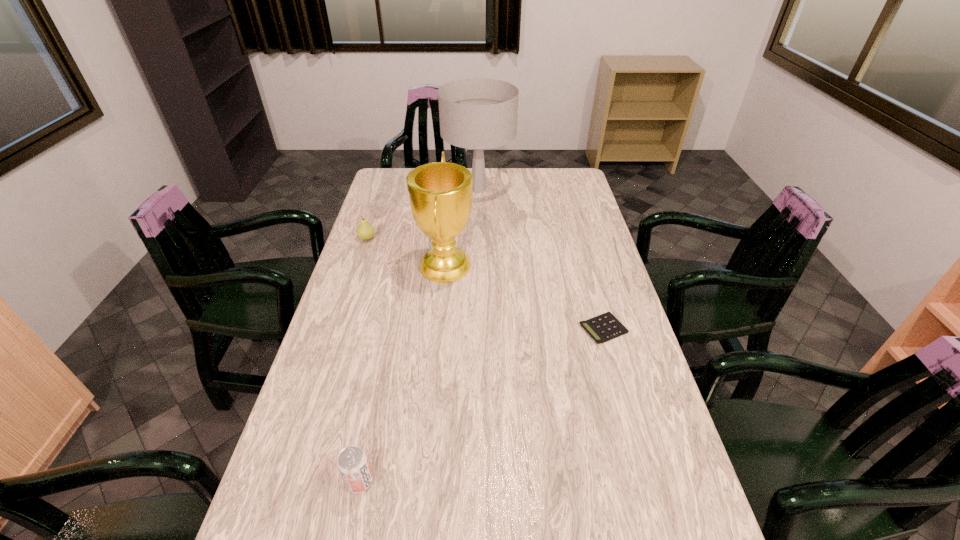
You are a GUI agent. You are given a task and a screenshot of the screen. Output one action in this format:
    pyautogui.click(x=<x>, y=<y>)
    Task: Click on the free space located on the back of the nearest object
    The image size is (960, 540).
    Given the screenshot: What is the action you would take?
    pyautogui.click(x=370, y=430)

Where is `free space located on the back of the leftmost object`? Image resolution: width=960 pixels, height=540 pixels. free space located on the back of the leftmost object is located at coordinates (372, 221).

You are a GUI agent. You are given a task and a screenshot of the screen. Output one action in this format:
    pyautogui.click(x=<x>, y=<y>)
    Task: Click on the vacant point located 0.190m on the left of the calculator
    
    Given the screenshot: What is the action you would take?
    pyautogui.click(x=516, y=329)

At what (x,y) coordinates should I click in order to perform the action: click on object that is positioned at the far edge. Please return your answer as a coordinate pair (x, y). Looking at the image, I should click on (476, 113).

Locate an element on the screen. soda can present at the left edge is located at coordinates (353, 465).

This screenshot has height=540, width=960. Identify the location of pear that is positioned at the left edge. (365, 231).

The width and height of the screenshot is (960, 540). I want to click on object at the right edge, so click(x=602, y=328).

Identify the location of vacant space at the far edge of the desktop. (497, 167).

At what (x,y) coordinates should I click in order to perform the action: click on free space at the left edge of the desktop. Please return your answer as a coordinate pair (x, y). The width and height of the screenshot is (960, 540). Looking at the image, I should click on (362, 378).

At what (x,y) coordinates should I click in order to perform the action: click on free space at the right edge of the desktop. Please return your answer as a coordinate pair (x, y). The height and width of the screenshot is (540, 960). Looking at the image, I should click on (555, 205).